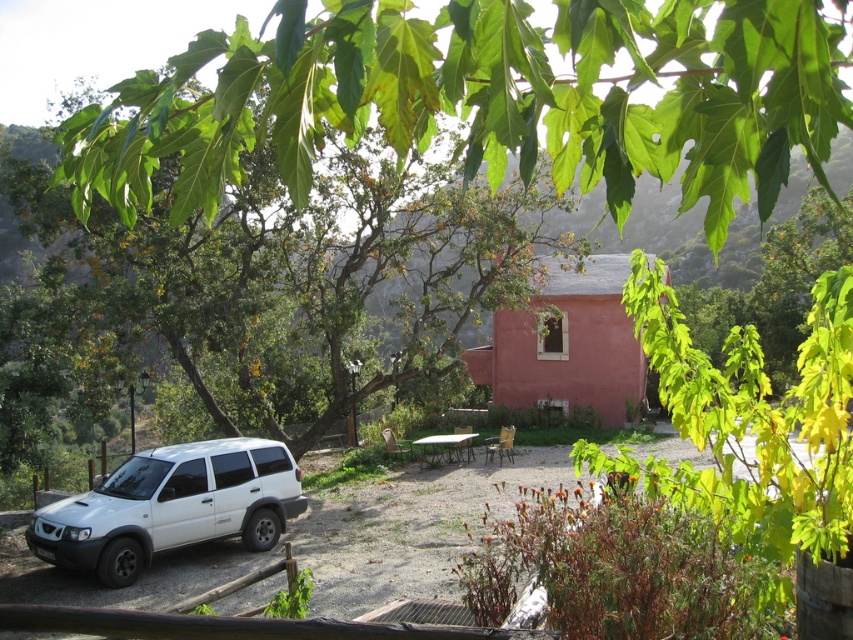
Question: Which of these objects is positioned closest to the wooden picnic table at center?

Choices:
 (A) white matte suv at lower left
 (B) green leafy tree at center

Answer: (B)

Question: Which point is farther from the camera taking this photo?

Choices:
 (A) (233, 348)
 (B) (421, 458)

Answer: (B)

Question: Is white matte suv at lower left further to camera compared to wooden picnic table at center?

Choices:
 (A) no
 (B) yes

Answer: (A)

Question: Is green leafy tree at center to the right of wooden picnic table at center from the viewer's perspective?

Choices:
 (A) no
 (B) yes

Answer: (A)

Question: Which object is positioned closest to the wooden picnic table at center?

Choices:
 (A) green leafy tree at upper center
 (B) green leafy tree at center

Answer: (B)

Question: Does green leafy tree at center appear on the left side of white matte suv at lower left?

Choices:
 (A) yes
 (B) no

Answer: (B)